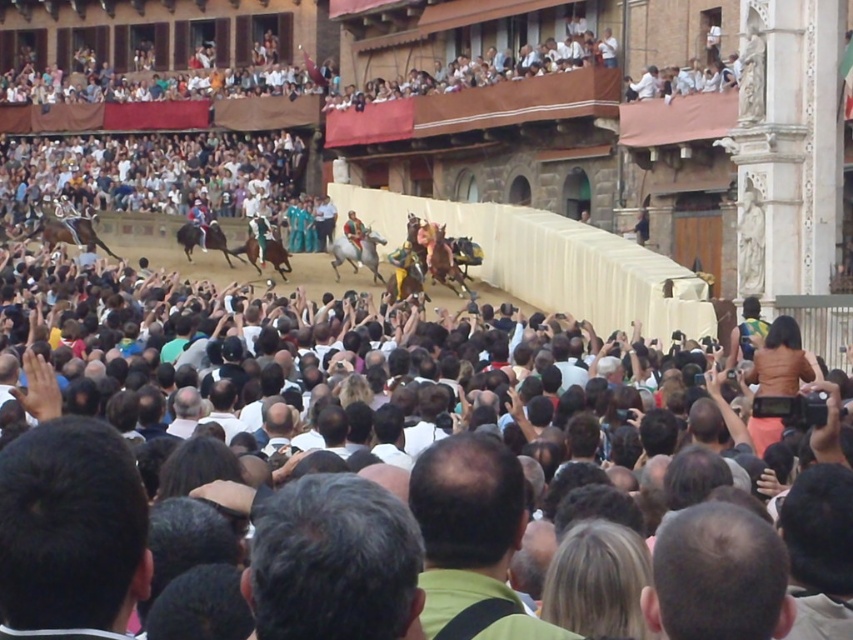
Where is `shiny gold horse at center`? This screenshot has width=853, height=640. shiny gold horse at center is located at coordinates (440, 257).

Does shiny gold horse at center appear on the left side of shiny brown horse at left?

No, shiny gold horse at center is not to the left of shiny brown horse at left.

The height and width of the screenshot is (640, 853). What do you see at coordinates (440, 257) in the screenshot?
I see `shiny gold horse at center` at bounding box center [440, 257].

Image resolution: width=853 pixels, height=640 pixels. Identify the location of shiny gold horse at center. (440, 257).

Is point (35, 618) positioned after point (190, 224)?

No, it is not.

Between point (91, 609) and point (204, 237), which one is positioned behind?

Positioned behind is point (204, 237).

Measure the distance between point (9,502) and camera.

Point (9,502) is 29.82 meters away from camera.

Locate an element on the screen. The image size is (853, 640). dark brown hair at lower left is located at coordinates (70, 529).

Is dark brown hair at lower left to the right of shiny gold horse at center from the viewer's perspective?

In fact, dark brown hair at lower left is to the left of shiny gold horse at center.

What do you see at coordinates (70, 529) in the screenshot?
I see `dark brown hair at lower left` at bounding box center [70, 529].

This screenshot has height=640, width=853. Identify the location of dark brown hair at lower left. (70, 529).